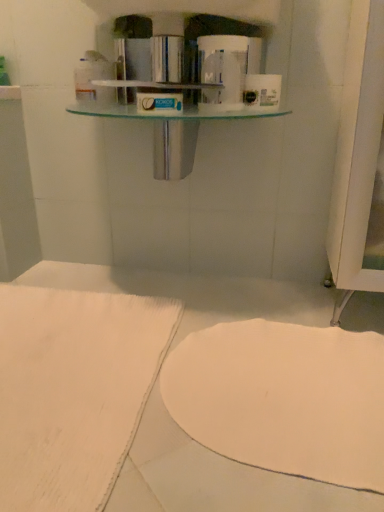
At what (x,y) coordinates should I click in order to perform the action: click on free point below white matte towel at lower center (from a real-world perspective). Please return your answer as a coordinate pair (x, y). The height and width of the screenshot is (512, 384). Looking at the image, I should click on (289, 428).